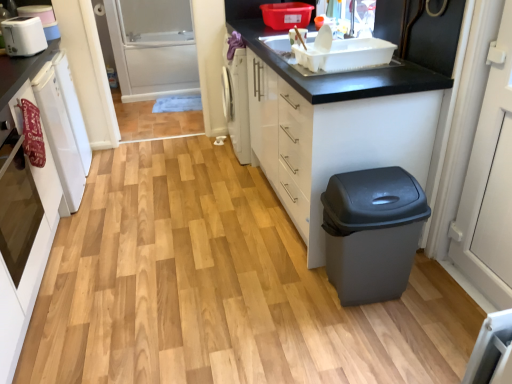
Question: From the image's perspective, is white plastic toaster at upper left located above matte gray plastic trash can at lower right?

Choices:
 (A) yes
 (B) no

Answer: (A)

Question: Is white plastic toaster at upper left outside of matte gray plastic trash can at lower right?

Choices:
 (A) no
 (B) yes

Answer: (B)

Question: Is white plastic toaster at upper left taller than matte gray plastic trash can at lower right?

Choices:
 (A) no
 (B) yes

Answer: (A)

Question: Is white plastic toaster at upper left positioned in front of matte gray plastic trash can at lower right?

Choices:
 (A) yes
 (B) no

Answer: (B)

Question: From the image's perspective, is white plastic toaster at upper left below matte gray plastic trash can at lower right?

Choices:
 (A) yes
 (B) no

Answer: (B)

Question: Is white plastic toaster at upper left far away from matte gray plastic trash can at lower right?

Choices:
 (A) yes
 (B) no

Answer: (A)

Question: From a real-world perspective, is white glossy oven at left over white plastic toaster at upper left?

Choices:
 (A) no
 (B) yes

Answer: (A)

Question: Considering the relative positions of white glossy oven at left and white plastic toaster at upper left in the image provided, is white glossy oven at left to the right of white plastic toaster at upper left from the viewer's perspective?

Choices:
 (A) yes
 (B) no

Answer: (A)

Question: Does white glossy oven at left have a lesser height compared to white plastic toaster at upper left?

Choices:
 (A) yes
 (B) no

Answer: (B)

Question: Can you confirm if white glossy oven at left is wider than white plastic toaster at upper left?

Choices:
 (A) no
 (B) yes

Answer: (B)

Question: Is white glossy oven at left behind white plastic toaster at upper left?

Choices:
 (A) no
 (B) yes

Answer: (A)

Question: Does white glossy oven at left contain white plastic toaster at upper left?

Choices:
 (A) no
 (B) yes

Answer: (A)

Question: From a real-world perspective, is white glossy cabinet at lower right, the 2th cabinetry when ordered from left to right, under matte gray plastic trash can at lower right?

Choices:
 (A) yes
 (B) no

Answer: (B)